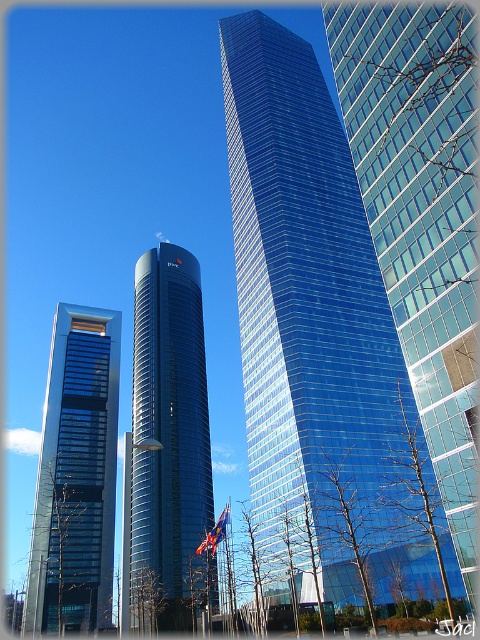
Question: Among these objects, which one is farthest from the camera?

Choices:
 (A) blue fabric flag at center
 (B) matte glass skyscraper at left

Answer: (A)

Question: Considering the relative positions of matte glass skyscraper at left and blue fabric flag at center in the image provided, where is matte glass skyscraper at left located with respect to blue fabric flag at center?

Choices:
 (A) above
 (B) below

Answer: (A)

Question: Which object is positioned closest to the smooth glass tower at center?

Choices:
 (A) matte glass skyscraper at left
 (B) glassy blue skyscraper at center

Answer: (A)

Question: Does matte glass skyscraper at left appear on the right side of blue fabric flag at center?

Choices:
 (A) yes
 (B) no

Answer: (B)

Question: Which object is closer to the camera taking this photo?

Choices:
 (A) blue fabric flag at center
 (B) matte glass skyscraper at left
 (C) smooth glass tower at center
 (D) glassy blue skyscraper at center

Answer: (C)

Question: Where is glassy blue skyscraper at center located in relation to blue fabric flag at center in the image?

Choices:
 (A) above
 (B) below

Answer: (A)